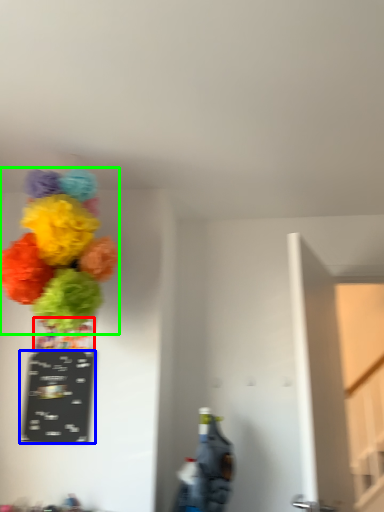
Question: Based on their relative distances, which object is farther from vase (highlighted by a red box)? Choose from writing (highlighted by a blue box) and flower (highlighted by a green box).

Choices:
 (A) writing
 (B) flower

Answer: (B)